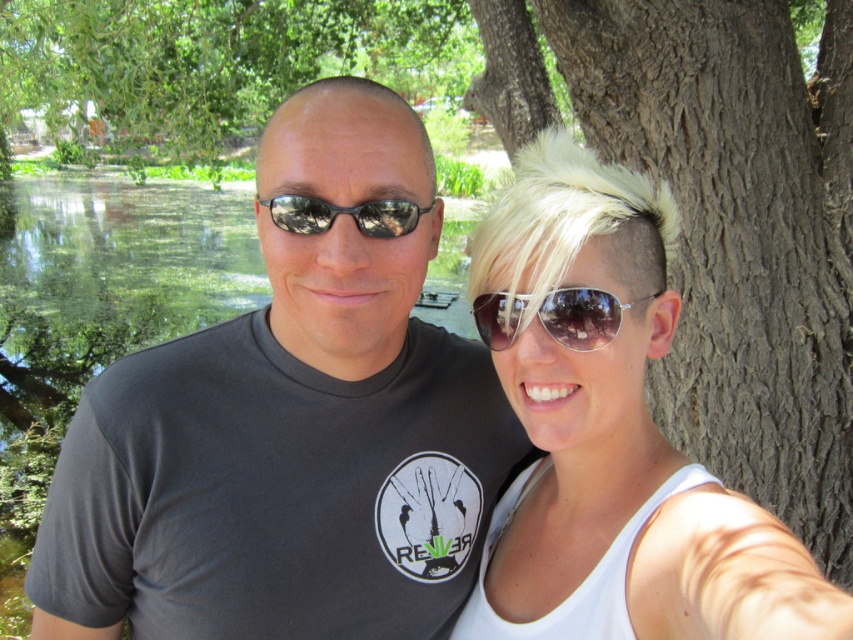
You are a photographer trying to capture a clear shot of both the blonde hair at center and the black reflective sunglasses at center. Since both are at the center, which one will appear larger in the photo?

The blonde hair at center will appear larger in the photo because it is taller than the black reflective sunglasses at center.

You are a photographer trying to capture the exact position of the shiny silver sunglasses at center in this image. What are their coordinates?

The coordinates of the shiny silver sunglasses at center are at point (583, 316).